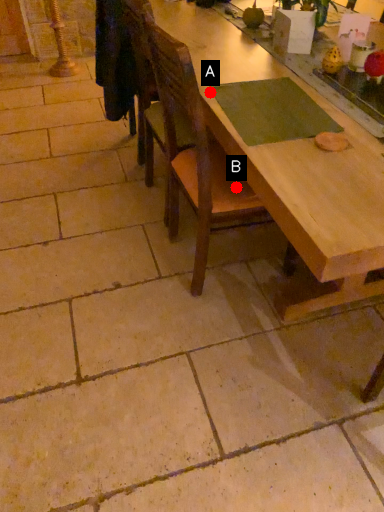
Question: Two points are circled on the image, labeled by A and B beside each circle. Which point is closer to the camera?

Choices:
 (A) A is closer
 (B) B is closer

Answer: (A)